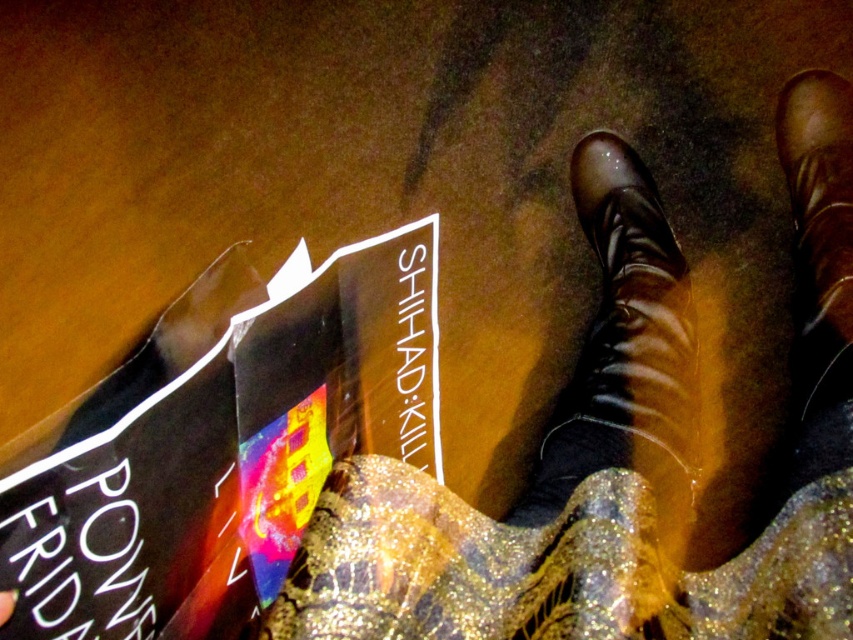
You are a photographer trying to capture both the shiny leather boot at center and the brown leather boot at center in a single frame. Which boot should you focus on first to ensure both are in the frame without moving the camera?

The shiny leather boot at center is bigger than the brown leather boot at center, so you should focus on the shiny leather boot at center first to ensure both are in the frame without moving the camera.

You are a photographer trying to capture the shiny leather boot at center in the image. If the camera is positioned at point 0.5, 0.5, will the boot be in the center of the frame?

The shiny leather boot at center is located at point (625,353), which is slightly to the right and below the camera position at (426,320). Therefore, the boot will not be exactly centered in the frame.